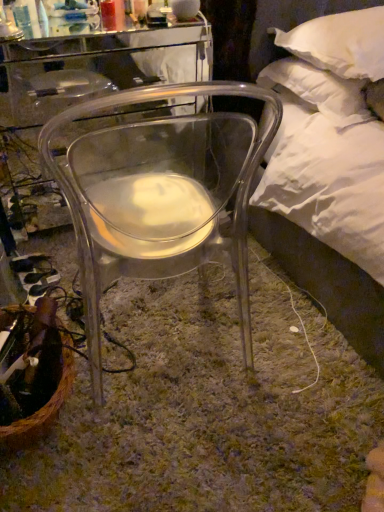
Question: Is transparent plastic chair at center closer to camera compared to white soft pillow at upper right, marked as the second pillow in a top-to-bottom arrangement?

Choices:
 (A) no
 (B) yes

Answer: (B)

Question: From a real-world perspective, is transparent plastic chair at center physically below white soft pillow at upper right, which is the first pillow in bottom-to-top order?

Choices:
 (A) yes
 (B) no

Answer: (A)

Question: Is transparent plastic chair at center not near white soft pillow at upper right, marked as the second pillow in a top-to-bottom arrangement?

Choices:
 (A) yes
 (B) no

Answer: (B)

Question: Is transparent plastic chair at center taller than white soft pillow at upper right, which is the first pillow in bottom-to-top order?

Choices:
 (A) no
 (B) yes

Answer: (B)

Question: Is white soft pillow at upper right, marked as the second pillow in a top-to-bottom arrangement, at the back of transparent plastic chair at center?

Choices:
 (A) yes
 (B) no

Answer: (B)

Question: Does transparent plastic chair at center have a lesser width compared to white soft pillow at upper right, marked as the second pillow in a top-to-bottom arrangement?

Choices:
 (A) yes
 (B) no

Answer: (B)

Question: Considering the relative sizes of white soft pillow at upper right, arranged as the second pillow when ordered from the bottom, and brown woven basket at lower left in the image provided, is white soft pillow at upper right, arranged as the second pillow when ordered from the bottom, taller than brown woven basket at lower left?

Choices:
 (A) yes
 (B) no

Answer: (A)

Question: Is white soft pillow at upper right, arranged as the second pillow when ordered from the bottom, located outside brown woven basket at lower left?

Choices:
 (A) yes
 (B) no

Answer: (A)

Question: Is white soft pillow at upper right, arranged as the second pillow when ordered from the bottom, bigger than brown woven basket at lower left?

Choices:
 (A) no
 (B) yes

Answer: (B)

Question: From a real-world perspective, is white soft pillow at upper right, the first pillow positioned from the top, below brown woven basket at lower left?

Choices:
 (A) yes
 (B) no

Answer: (B)

Question: Can you confirm if white soft pillow at upper right, arranged as the second pillow when ordered from the bottom, is shorter than brown woven basket at lower left?

Choices:
 (A) yes
 (B) no

Answer: (B)

Question: Can you confirm if white soft pillow at upper right, the first pillow positioned from the top, is smaller than brown woven basket at lower left?

Choices:
 (A) yes
 (B) no

Answer: (B)

Question: Is white soft pillow at upper right, the first pillow positioned from the top, located within transparent plastic chair at center?

Choices:
 (A) yes
 (B) no

Answer: (B)